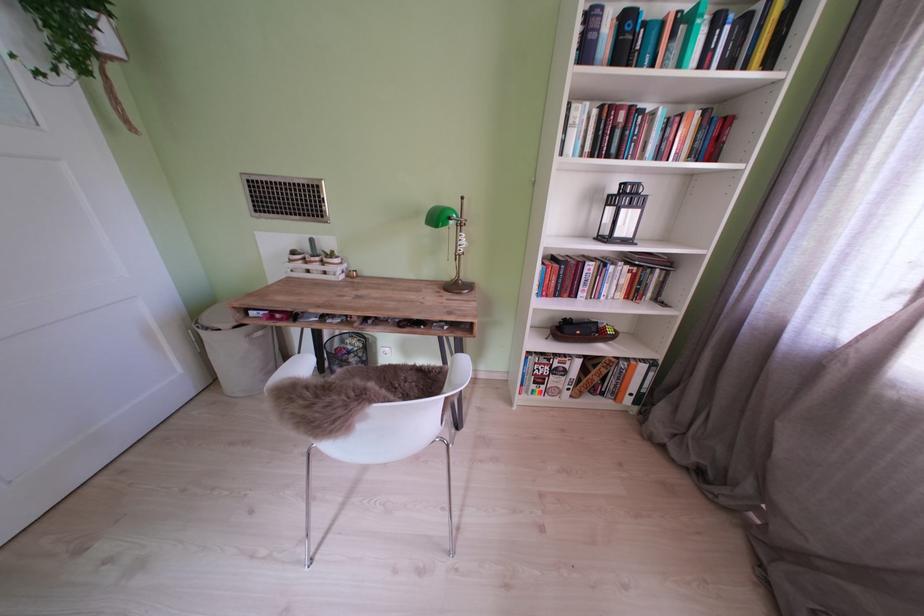
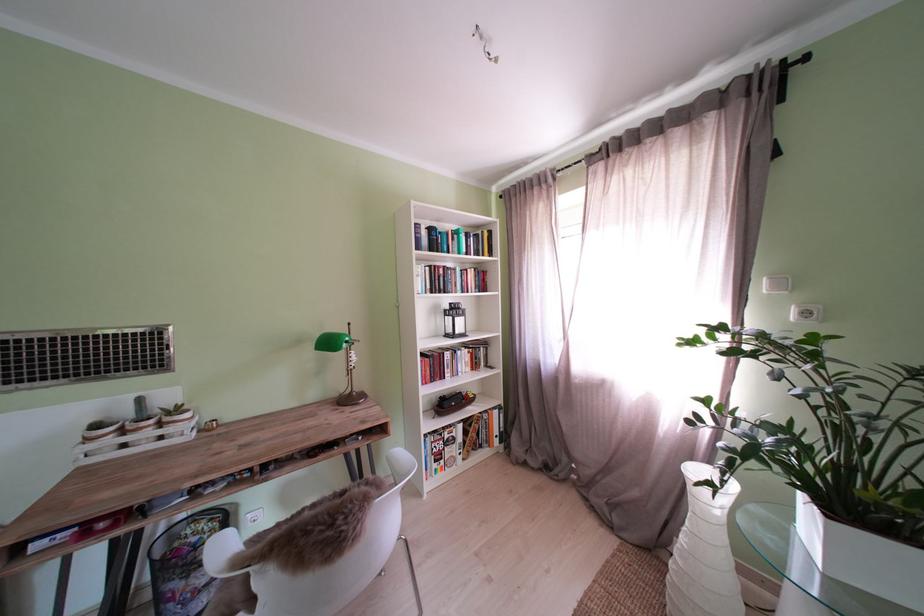
The point at (585, 379) is marked in the first image. Where is the corresponding point in the second image?

(470, 444)